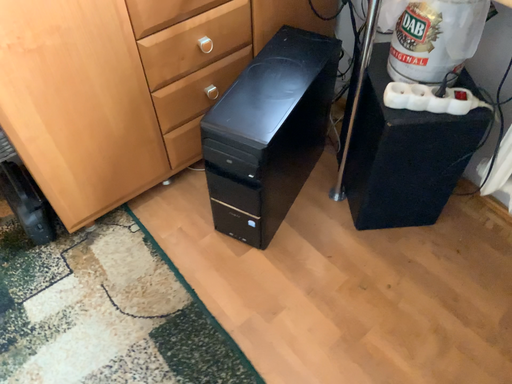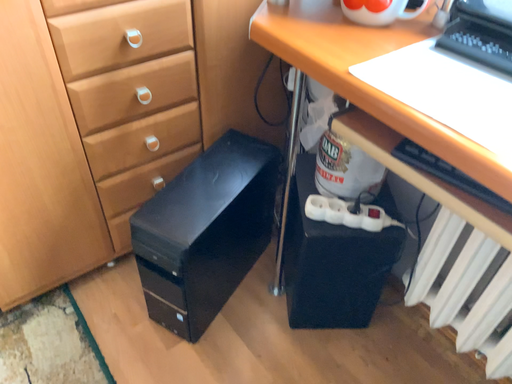
Question: How did the camera likely rotate when shooting the video?

Choices:
 (A) rotated downward
 (B) rotated upward

Answer: (B)